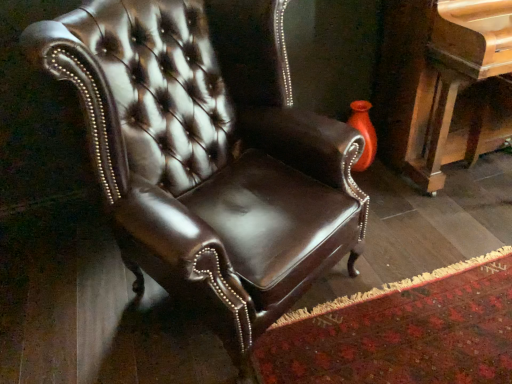
The image size is (512, 384). I want to click on vacant space to the right of shiny brown leather chair at center, so click(x=412, y=286).